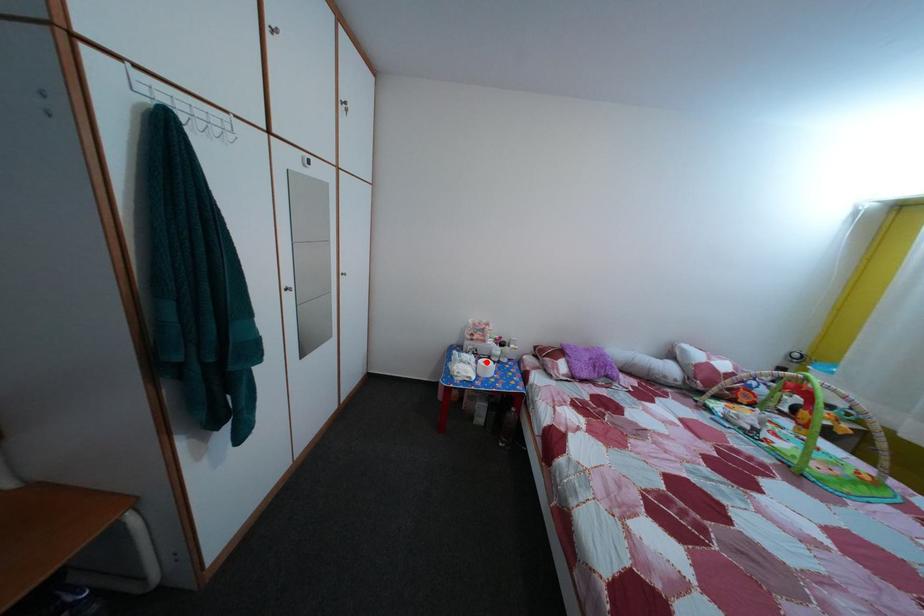
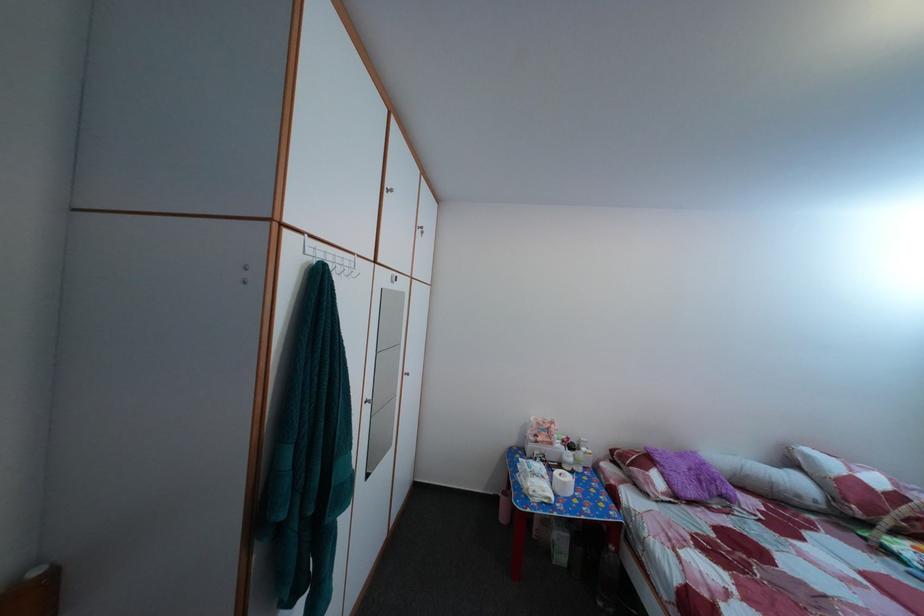
Where in the second image is the point corresponding to the highlighted location from the first image?

(555, 469)